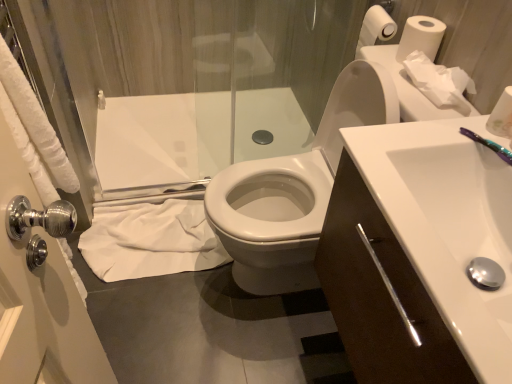
The height and width of the screenshot is (384, 512). What are the coordinates of `blank space to the left of purple plastic toothbrush at upper right` in the screenshot? It's located at (413, 147).